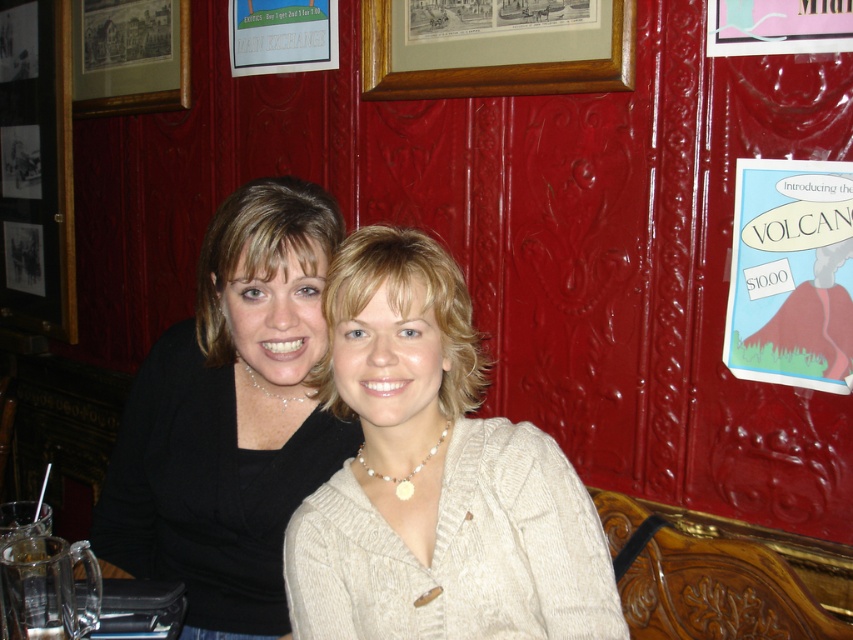
Question: Estimate the real-world distances between objects in this image. Which object is farther from the matte black sweater at center?

Choices:
 (A) wooden frame at upper center
 (B) matte white sweater at center
 (C) wooden framed print at upper left

Answer: (C)

Question: Which of these objects is positioned farthest from the wooden frame at upper center?

Choices:
 (A) matte black sweater at center
 (B) matte white sweater at center
 (C) wooden framed print at upper left

Answer: (C)

Question: Can you confirm if matte white sweater at center is smaller than matte black sweater at center?

Choices:
 (A) yes
 (B) no

Answer: (A)

Question: Among these objects, which one is nearest to the camera?

Choices:
 (A) wooden frame at upper center
 (B) wooden framed print at upper left

Answer: (A)

Question: Can you confirm if matte white sweater at center is smaller than matte black sweater at center?

Choices:
 (A) yes
 (B) no

Answer: (A)

Question: Can you confirm if matte black sweater at center is wider than wooden frame at upper center?

Choices:
 (A) no
 (B) yes

Answer: (A)